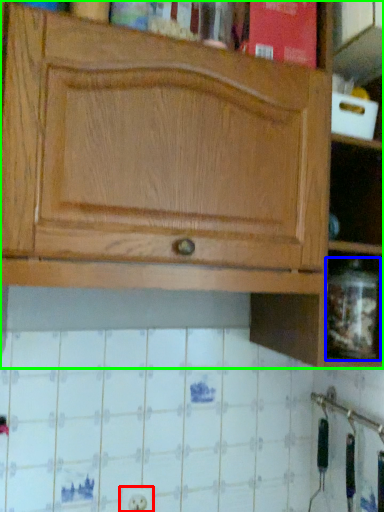
Question: Which is nearer to the electric outlet (highlighted by a red box)? glass jar (highlighted by a blue box) or cabinetry (highlighted by a green box).

Choices:
 (A) glass jar
 (B) cabinetry

Answer: (A)